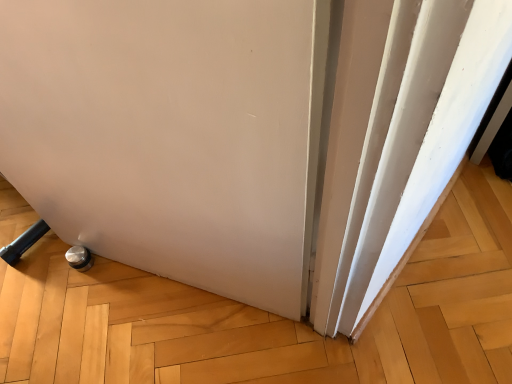
Question: In terms of height, does white matte curtain at right look taller or shorter compared to white matte door at lower left?

Choices:
 (A) short
 (B) tall

Answer: (A)

Question: From the image's perspective, relative to white matte door at lower left, is white matte curtain at right above or below?

Choices:
 (A) above
 (B) below

Answer: (A)

Question: From a real-world perspective, relative to white matte door at lower left, is white matte curtain at right vertically above or below?

Choices:
 (A) below
 (B) above

Answer: (A)

Question: Looking at their shapes, would you say white matte door at lower left is wider or thinner than white matte curtain at right?

Choices:
 (A) wide
 (B) thin

Answer: (B)

Question: Visually, is white matte door at lower left positioned to the left or to the right of white matte curtain at right?

Choices:
 (A) right
 (B) left

Answer: (B)

Question: From their relative heights in the image, would you say white matte door at lower left is taller or shorter than white matte curtain at right?

Choices:
 (A) tall
 (B) short

Answer: (A)

Question: In the image, is white matte door at lower left positioned in front of or behind white matte curtain at right?

Choices:
 (A) behind
 (B) front

Answer: (B)